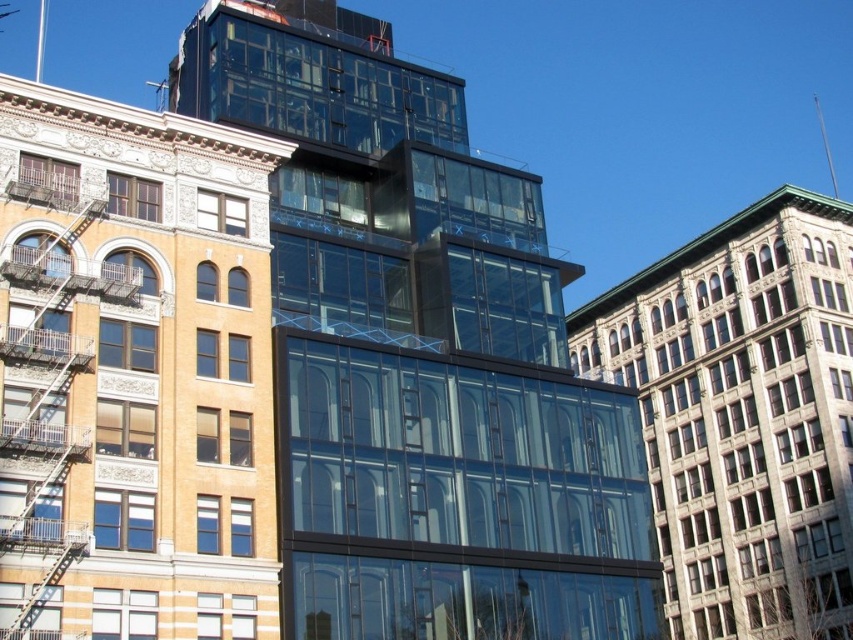
Question: Which point is farther from the camera taking this photo?

Choices:
 (A) (28, 400)
 (B) (347, 54)

Answer: (B)

Question: Considering the real-world distances, which object is closest to the clear glass building at center?

Choices:
 (A) transparent glass building at center
 (B) metallic silver fire escape at left

Answer: (B)

Question: Can you confirm if clear glass building at center is smaller than metallic silver fire escape at left?

Choices:
 (A) no
 (B) yes

Answer: (A)

Question: Can you confirm if clear glass building at center is wider than gray stone building at right?

Choices:
 (A) yes
 (B) no

Answer: (B)

Question: Which object is positioned closest to the clear glass building at center?

Choices:
 (A) gray stone building at right
 (B) metallic silver fire escape at left
 (C) transparent glass building at center

Answer: (B)

Question: Can you confirm if clear glass building at center is positioned to the left of metallic silver fire escape at left?

Choices:
 (A) yes
 (B) no

Answer: (B)